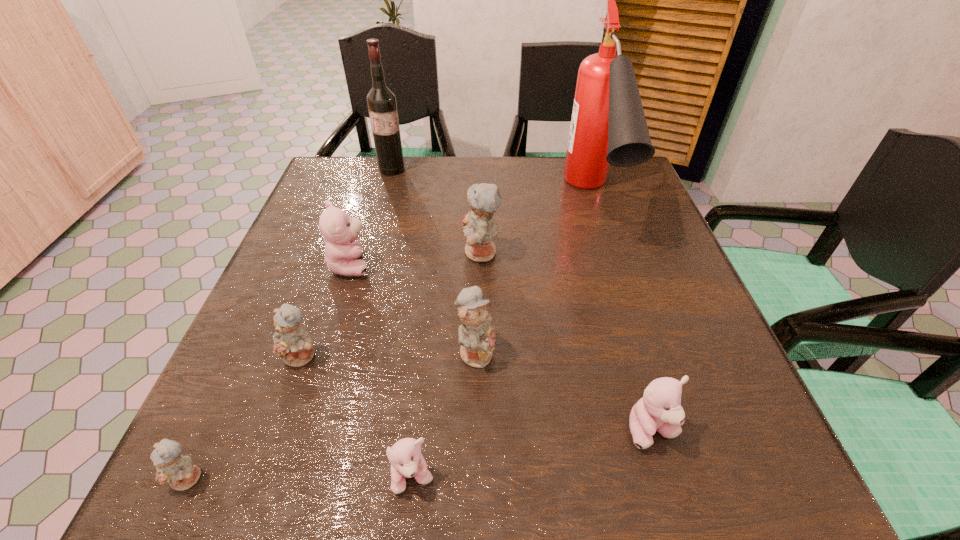
The height and width of the screenshot is (540, 960). Find the location of `free space that satisfies the following two spatial constraints: 1. at the nozzle of the red fire extinguisher; 2. on the front-facing side of the biggest blue teddy bear`. free space that satisfies the following two spatial constraints: 1. at the nozzle of the red fire extinguisher; 2. on the front-facing side of the biggest blue teddy bear is located at coordinates (608, 253).